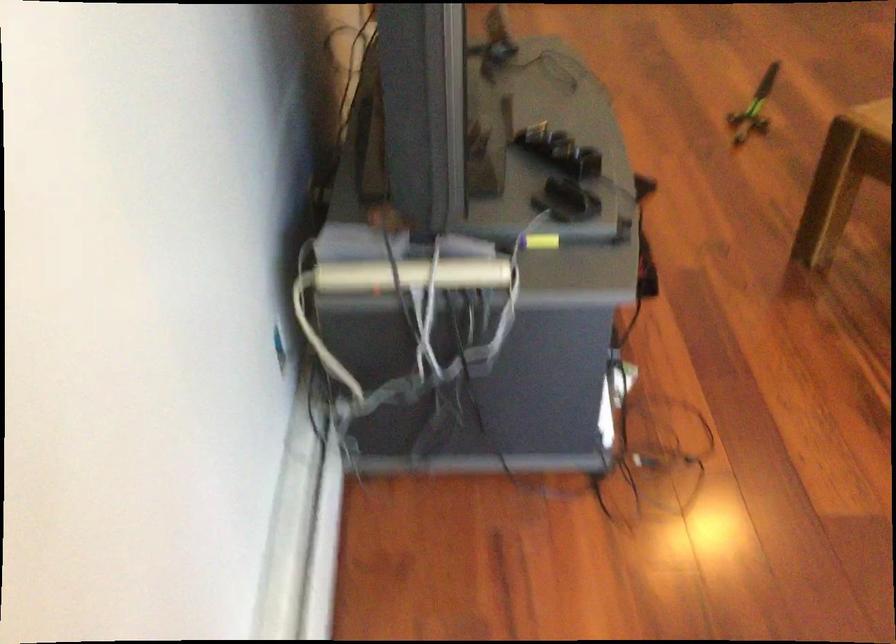
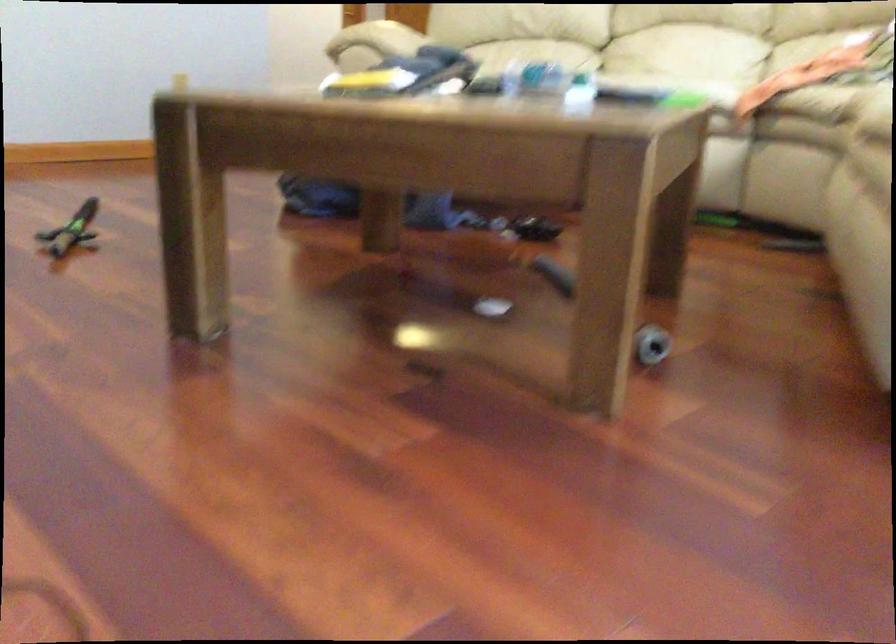
Question: The first image is from the beginning of the video and the second image is from the end. How did the camera likely rotate when shooting the video?

Choices:
 (A) Left
 (B) Right
 (C) Up
 (D) Down

Answer: (B)